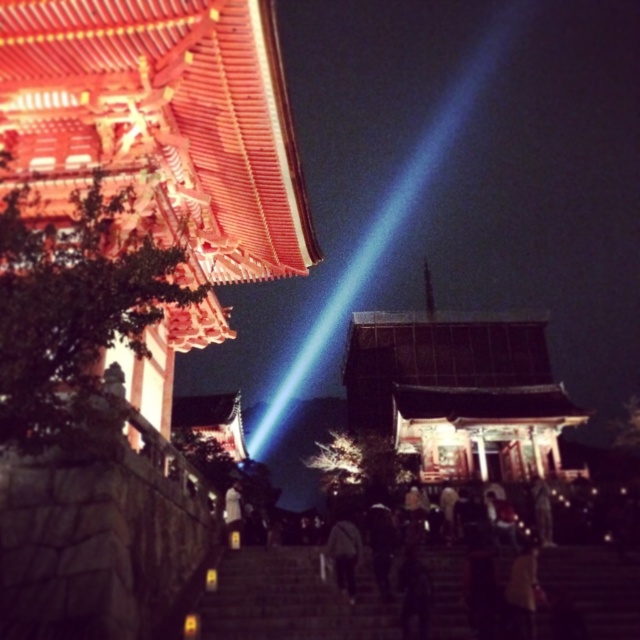
You are a photographer trying to capture the main building in the scene. You notice two people in the foreground, a dark gray fabric jacket at center and a white matte person at center. Which one is blocking your view more due to their height?

The dark gray fabric jacket at center is taller than the white matte person at center, so it is blocking the view more.

You are standing at the bottom of the dark stone stairs at center and want to reach the white matte person at center. Which direction should you move?

The dark stone stairs at center is located above the white matte person at center, so you should move upward to reach them.